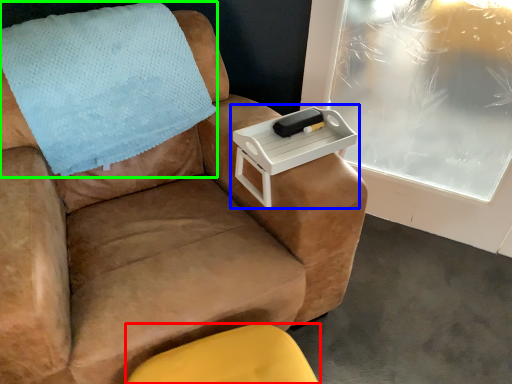
Question: Considering the real-world distances, which object is closest to furniture (highlighted by a red box)? table (highlighted by a blue box) or blanket (highlighted by a green box).

Choices:
 (A) table
 (B) blanket

Answer: (A)